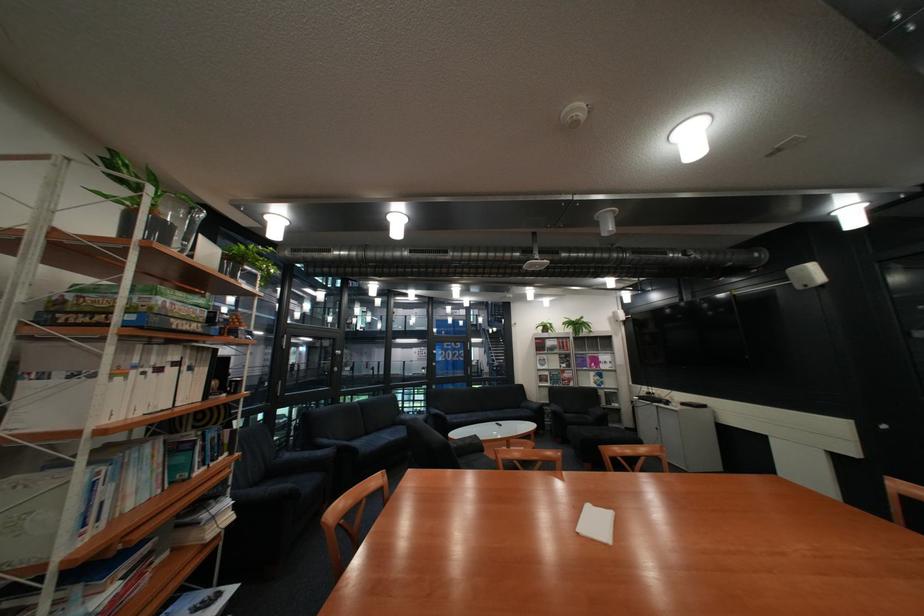
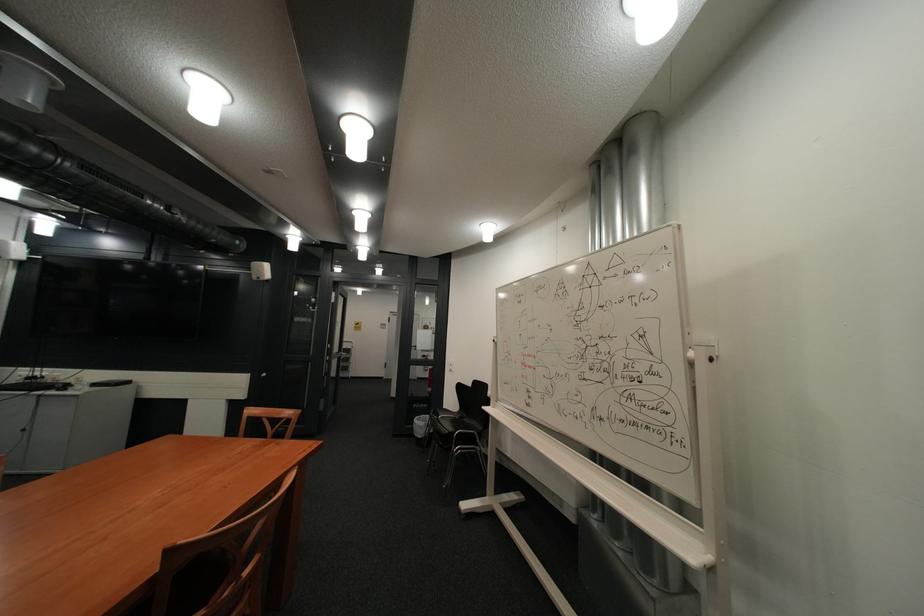
Question: The first image is from the beginning of the video and the second image is from the end. How did the camera likely rotate when shooting the video?

Choices:
 (A) Left
 (B) Right
 (C) Up
 (D) Down

Answer: (B)